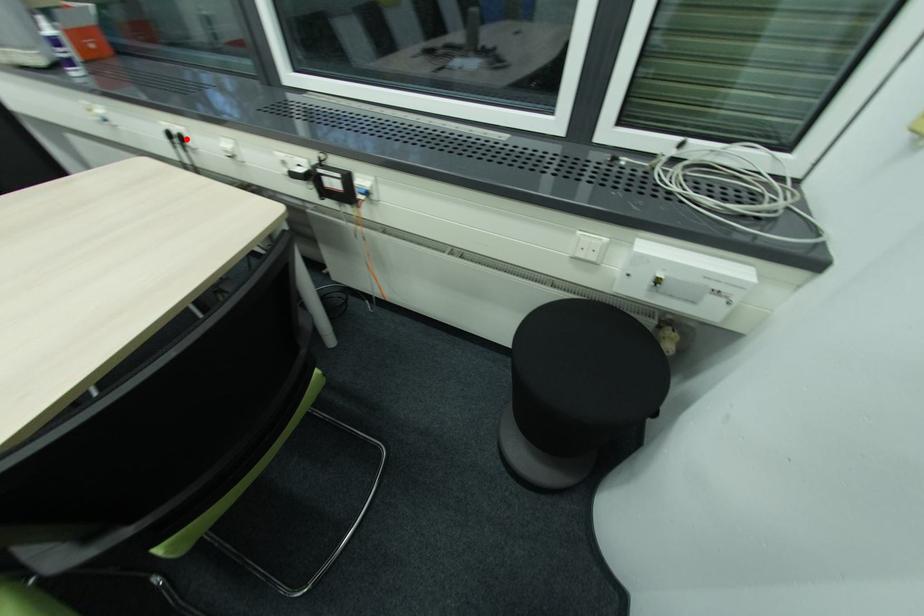
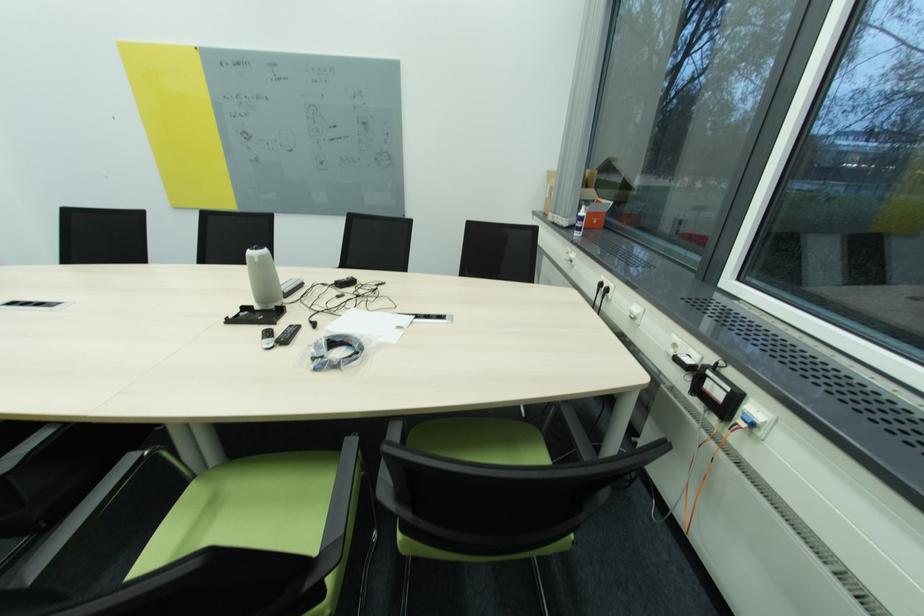
Where in the second image is the point corresponding to the highlighted location from the first image?

(612, 291)